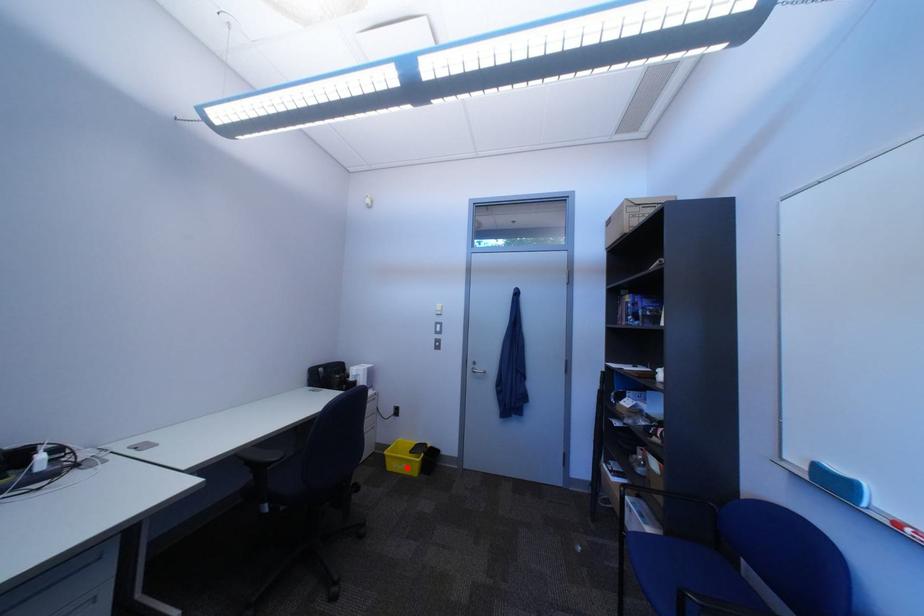
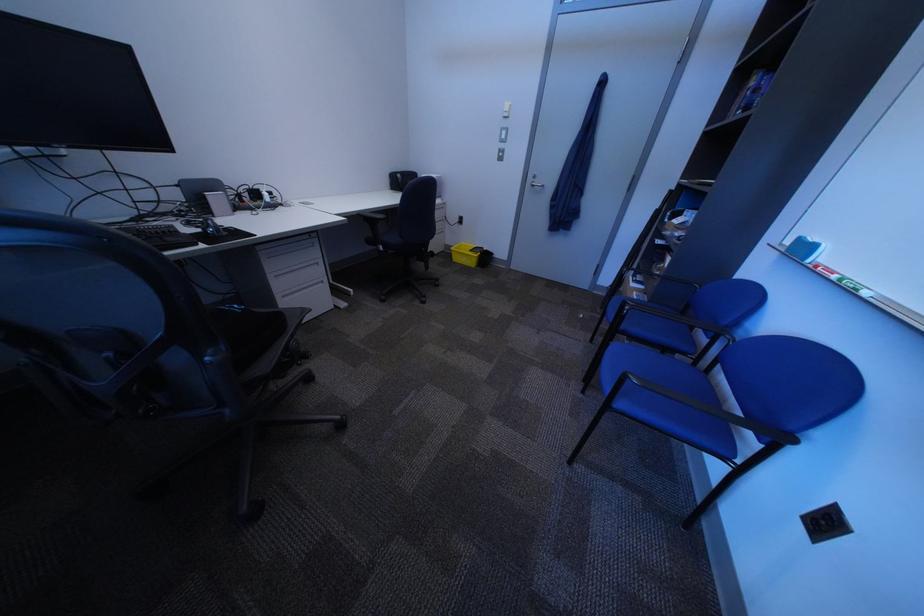
Question: I am providing you with two images of the same scene from different viewpoints. Given a red point in image1, look at the same physical point in image2. Is it:

Choices:
 (A) Closer to the viewpoint
 (B) Farther from the viewpoint

Answer: (A)